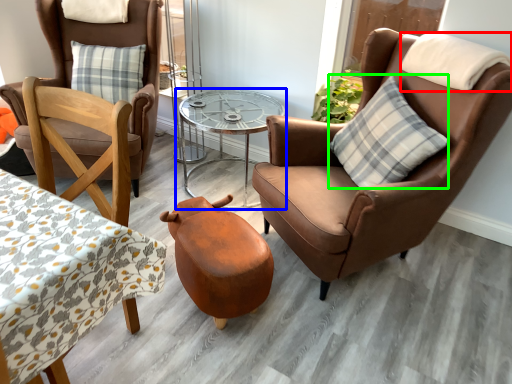
Question: Which is farther away from pillow (highlighted by a red box)? table (highlighted by a blue box) or pillow (highlighted by a green box)?

Choices:
 (A) table
 (B) pillow

Answer: (A)